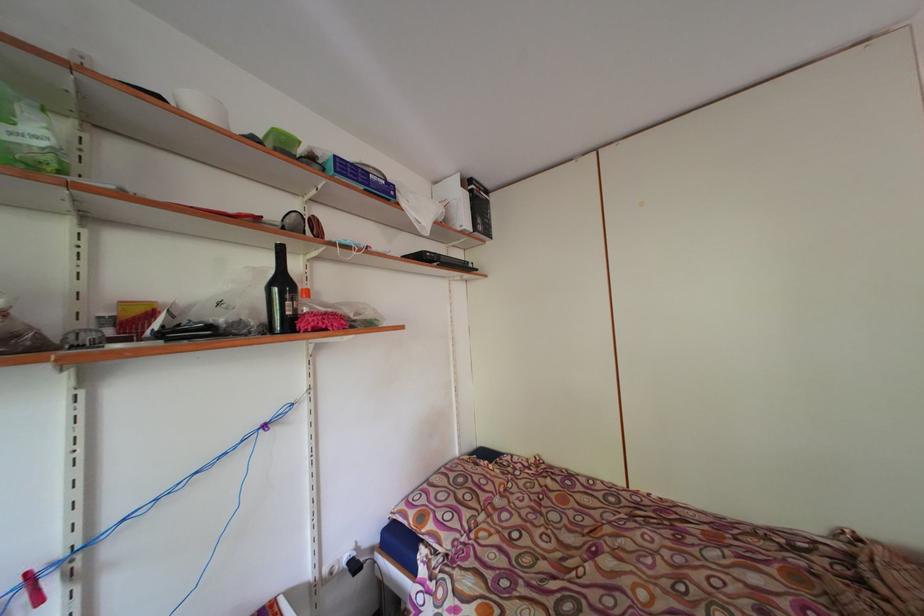
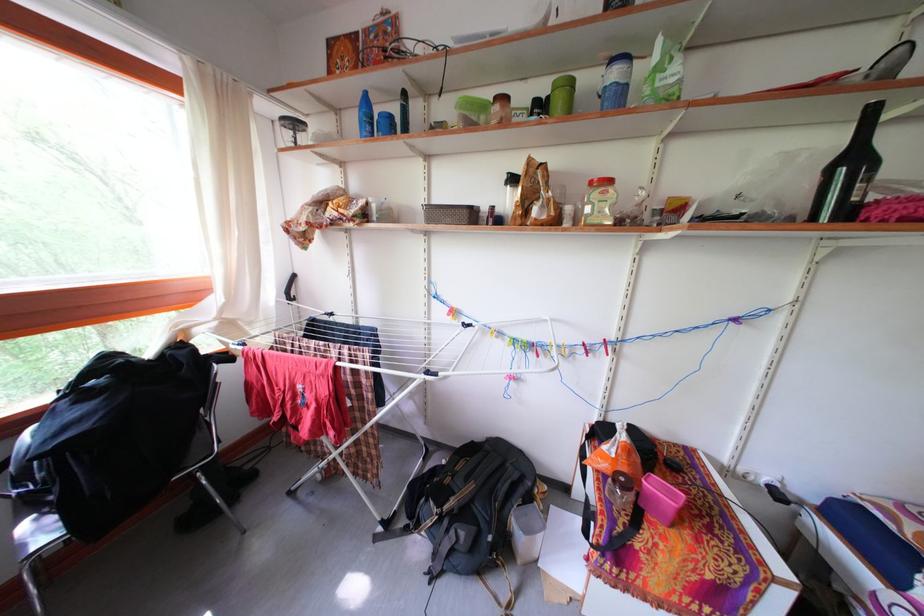
Find the pixel in the second image that matches point 290,289 in the first image.

(861, 166)